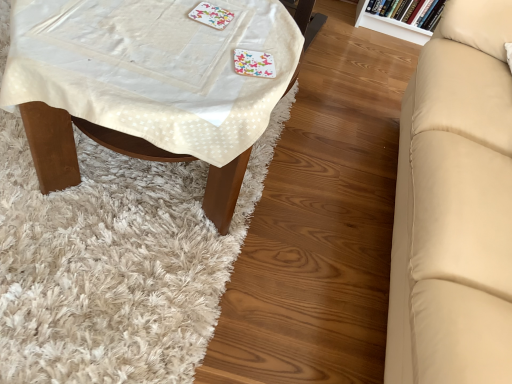
Identify the location of vacant area located to the right-hand side of colorful paper coaster at upper center. (269, 37).